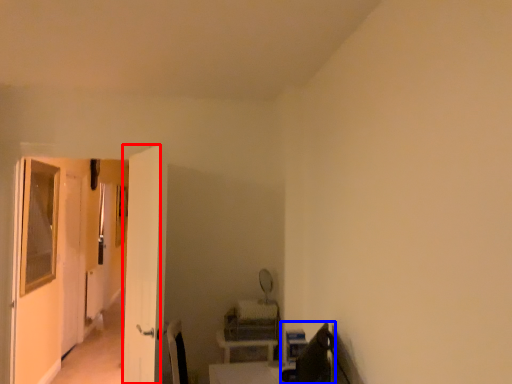
Question: Which of the following is the farthest to the observer, screen door (highlighted by a red box) or swivel chair (highlighted by a blue box)?

Choices:
 (A) screen door
 (B) swivel chair

Answer: (A)